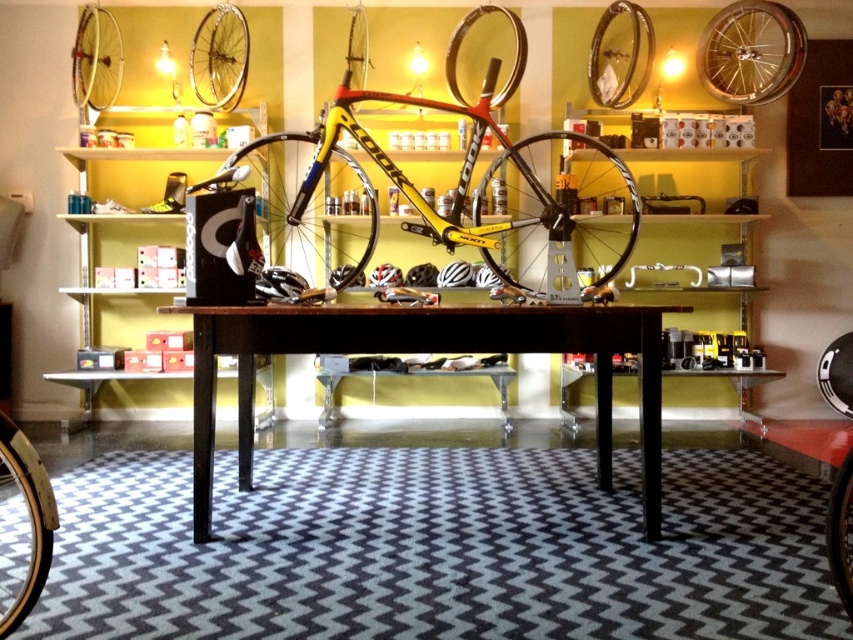
Question: Estimate the real-world distances between objects in this image. Which object is farther from the yellow matte bicycle at center?

Choices:
 (A) shiny gold rim at upper left
 (B) yellow matte tire at center

Answer: (A)

Question: Among these points, which one is farthest from the camera?

Choices:
 (A) (780, 4)
 (B) (640, 316)
 (C) (96, 97)

Answer: (C)

Question: Is brown wooden table at center closer to camera compared to shiny gold rim at upper left?

Choices:
 (A) no
 (B) yes

Answer: (B)

Question: Can you confirm if shiny gold rim at upper left is positioned to the right of black rubber tire at center?

Choices:
 (A) yes
 (B) no

Answer: (B)

Question: Does yellow matte bicycle at center come behind brown wooden table at center?

Choices:
 (A) no
 (B) yes

Answer: (B)

Question: Which of the following is the farthest from the observer?

Choices:
 (A) (573, 259)
 (B) (219, 48)
 (C) (103, 19)

Answer: (C)